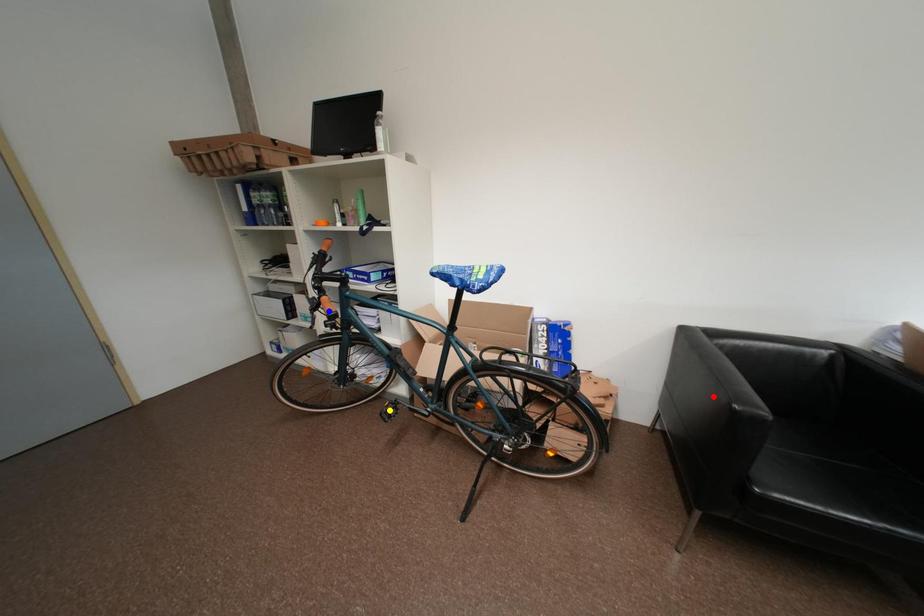
Order these from farthest to nearest:
- red point
- yellow point
- blue point

yellow point, blue point, red point